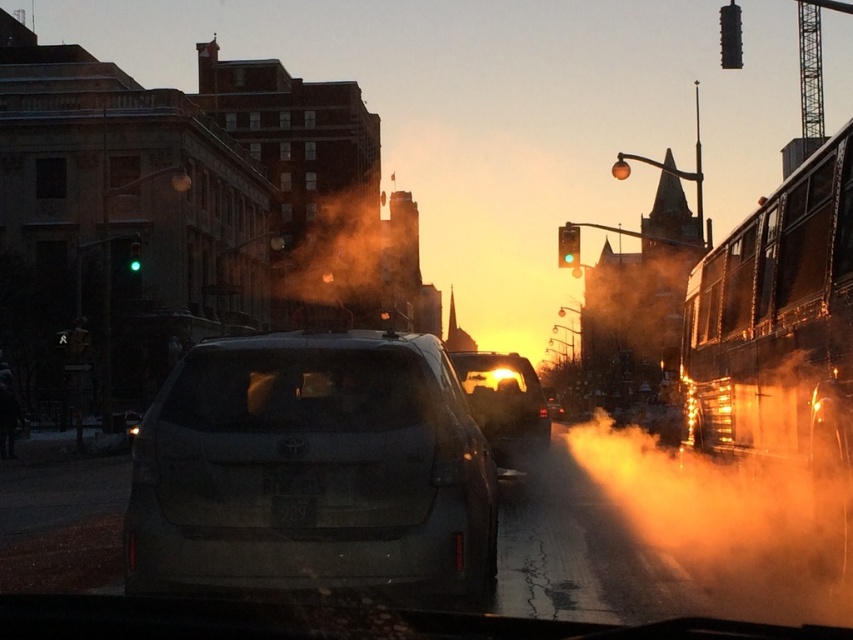
You are a pedestrian standing at the curb and see the smokey gray suv at center and the black matte license plate at center. Which object is closer to the left side of the road?

The black matte license plate at center is closer to the left side of the road because the smokey gray suv at center is to the right of it.

You are a pedestrian standing on the sidewalk observing the smokey gray suv at center and the black matte license plate at center. Which object is closer to the top of the image?

The smokey gray suv at center is located above the black matte license plate at center, so it is closer to the top of the image.

You are a delivery driver who needs to park your car at a specific spot marked by the point at coordinates point (419, 349). Your car is currently 20 feet away from the parking spot. Can you safely move forward to reach the spot without oversteering?

The distance of point (419, 349) from camera is 18.26 feet, so you are actually closer than you think. Moving forward cautiously should allow you to reach the spot without oversteering.